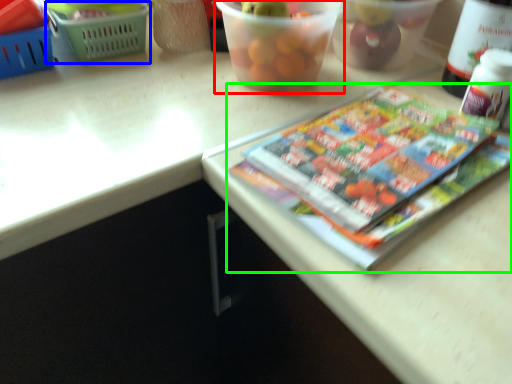
Question: Which is farther away from glass bowl (highlighted by a red box)? basket (highlighted by a blue box) or book (highlighted by a green box)?

Choices:
 (A) basket
 (B) book

Answer: (A)